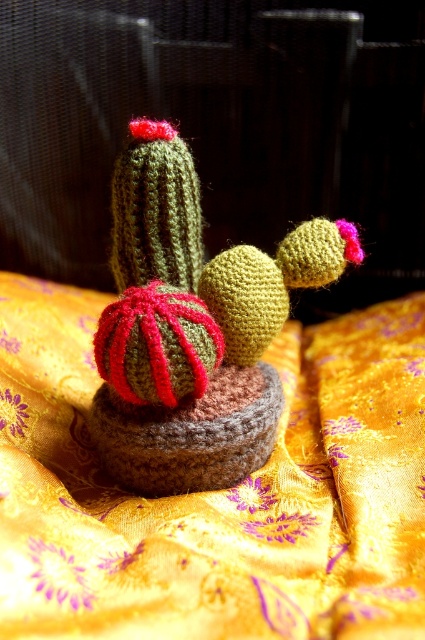
Does yellow satin blanket at center have a smaller size compared to knitted green cactus at center?

Incorrect, yellow satin blanket at center is not smaller in size than knitted green cactus at center.

Who is positioned more to the left, yellow satin blanket at center or knitted green cactus at center?

Positioned to the left is yellow satin blanket at center.

The image size is (425, 640). What are the coordinates of `yellow satin blanket at center` in the screenshot? It's located at (215, 492).